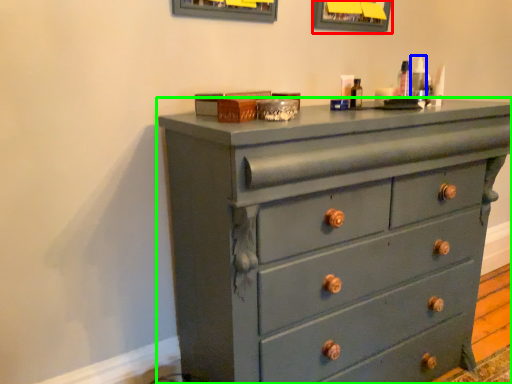
Question: Estimate the real-world distances between objects in this image. Which object is farther from picture frame (highlighted by a red box), toiletry (highlighted by a blue box) or chest of drawers (highlighted by a green box)?

Choices:
 (A) toiletry
 (B) chest of drawers

Answer: (B)